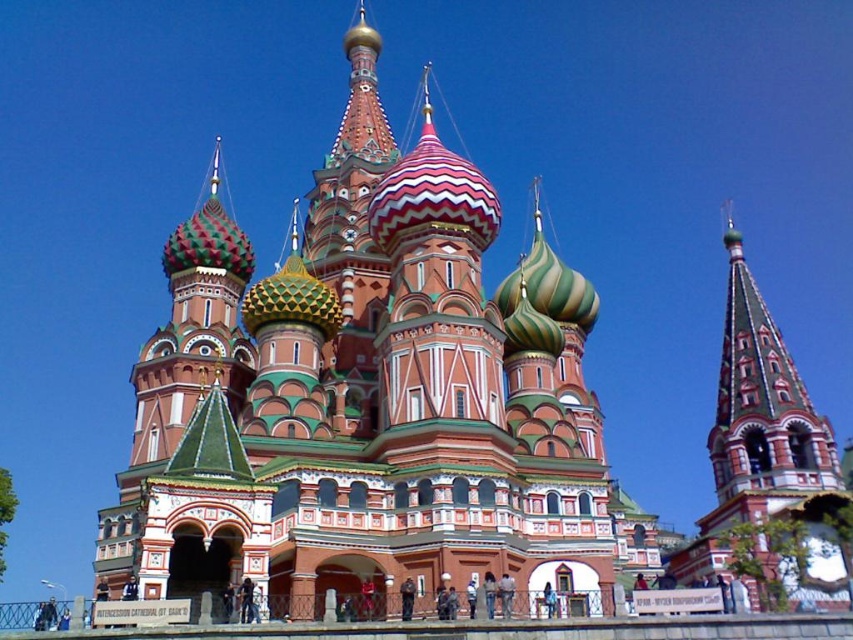
Question: Is polychrome woodwork church at center bigger than polished wood spire at right?

Choices:
 (A) no
 (B) yes

Answer: (B)

Question: Is polychrome woodwork church at center closer to the viewer compared to polished wood spire at right?

Choices:
 (A) yes
 (B) no

Answer: (A)

Question: Is polychrome woodwork church at center behind polished wood spire at right?

Choices:
 (A) no
 (B) yes

Answer: (A)

Question: Which object appears closest to the camera in this image?

Choices:
 (A) polychrome woodwork church at center
 (B) polished wood spire at right

Answer: (A)